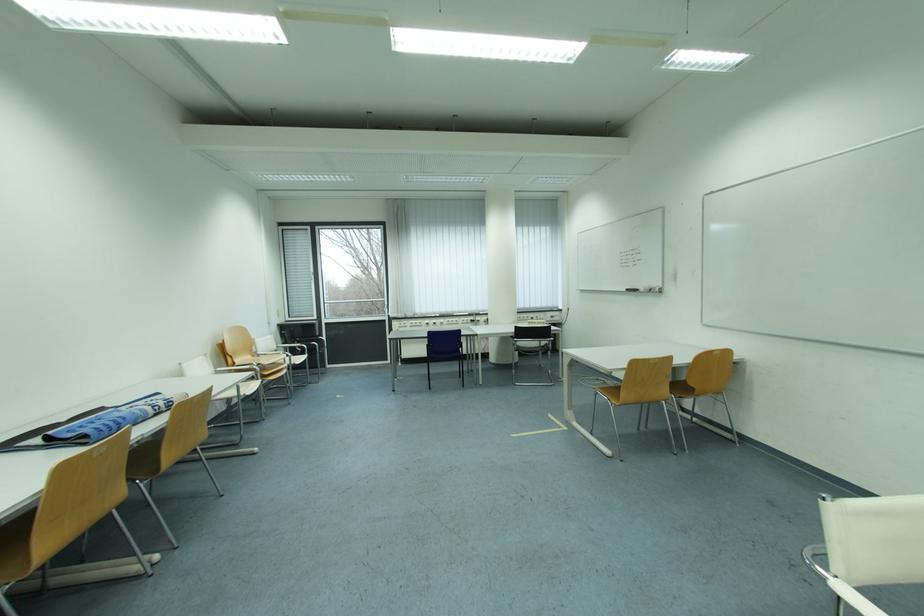
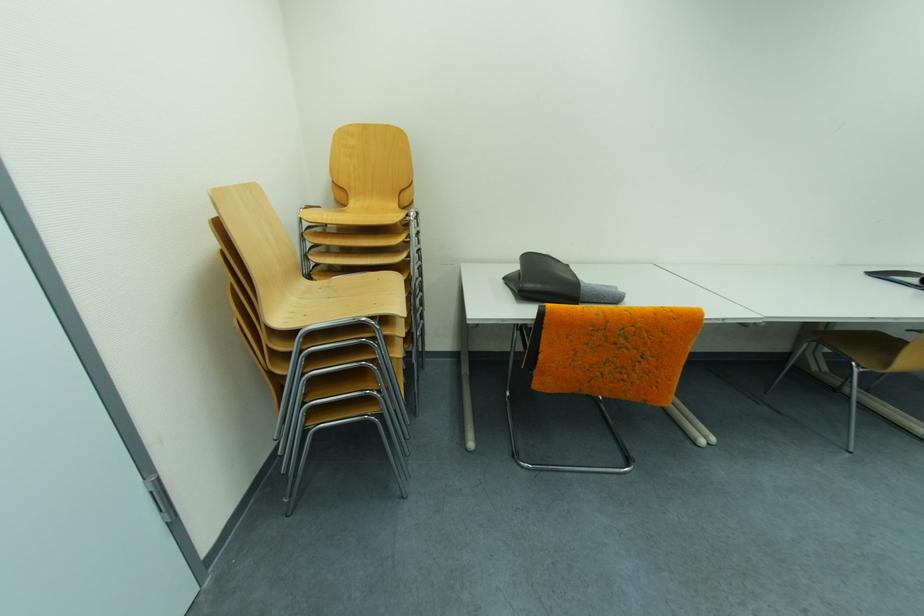
The images are taken continuously from a first-person perspective. In which direction is your viewpoint rotating?

The camera's rotation is toward left-down.